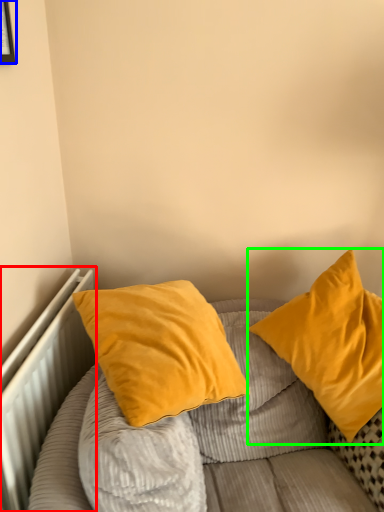
Question: Based on their relative distances, which object is farther from radiator (highlighted by a red box)? Choose from picture frame (highlighted by a blue box) and pillow (highlighted by a green box).

Choices:
 (A) picture frame
 (B) pillow

Answer: (A)